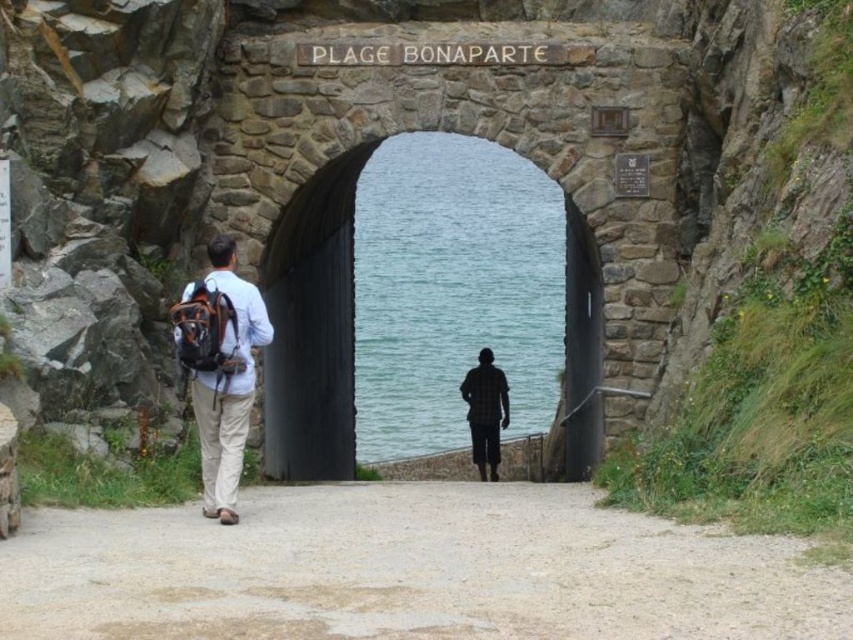
Question: Among these points, which one is nearest to the camera?

Choices:
 (A) (497, 424)
 (B) (422, 212)
 (C) (268, 324)

Answer: (C)

Question: Does dirt/gravel path at center appear on the right side of smooth stone door at center?

Choices:
 (A) no
 (B) yes

Answer: (A)

Question: Which point is farther to the camera?

Choices:
 (A) (633, 628)
 (B) (242, 428)
 (C) (564, 412)

Answer: (C)

Question: Can you confirm if clear blue water at center is positioned above plaid fabric shirt at center?

Choices:
 (A) yes
 (B) no

Answer: (A)

Question: Which is farther from the smooth stone door at center?

Choices:
 (A) plaid fabric shirt at center
 (B) dirt/gravel path at center
 (C) clear blue water at center

Answer: (B)

Question: Can you confirm if matte black backpack at left is positioned below smooth stone door at center?

Choices:
 (A) no
 (B) yes

Answer: (B)